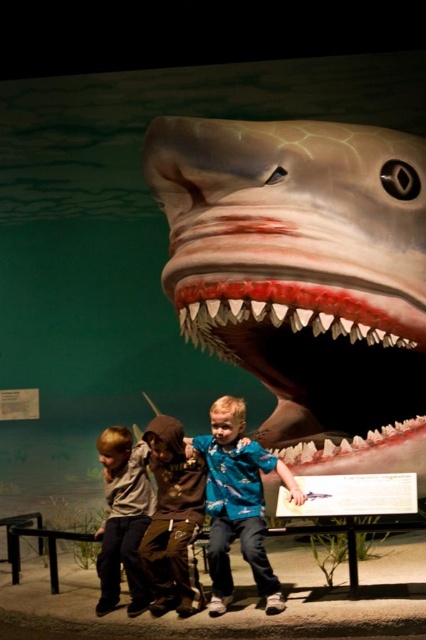
Question: Considering the relative positions of brown cotton hoodie at center and brown leather jacket at lower left in the image provided, where is brown cotton hoodie at center located with respect to brown leather jacket at lower left?

Choices:
 (A) right
 (B) left

Answer: (A)

Question: In this image, where is smooth gray shark at center located relative to brown cotton hoodie at center?

Choices:
 (A) right
 (B) left

Answer: (A)

Question: In this image, where is smooth gray shark at center located relative to brown cotton hoodie at center?

Choices:
 (A) right
 (B) left

Answer: (A)

Question: Which object appears closest to the camera in this image?

Choices:
 (A) blue fabric shirt at center
 (B) brown cotton hoodie at center
 (C) brown leather jacket at lower left

Answer: (A)

Question: Which point is farther from the camera taking this photo?

Choices:
 (A) (216, 545)
 (B) (166, 609)

Answer: (B)

Question: Which of these objects is positioned closest to the blue fabric shirt at center?

Choices:
 (A) brown cotton hoodie at center
 (B) brown leather jacket at lower left
 (C) smooth gray shark at center

Answer: (A)